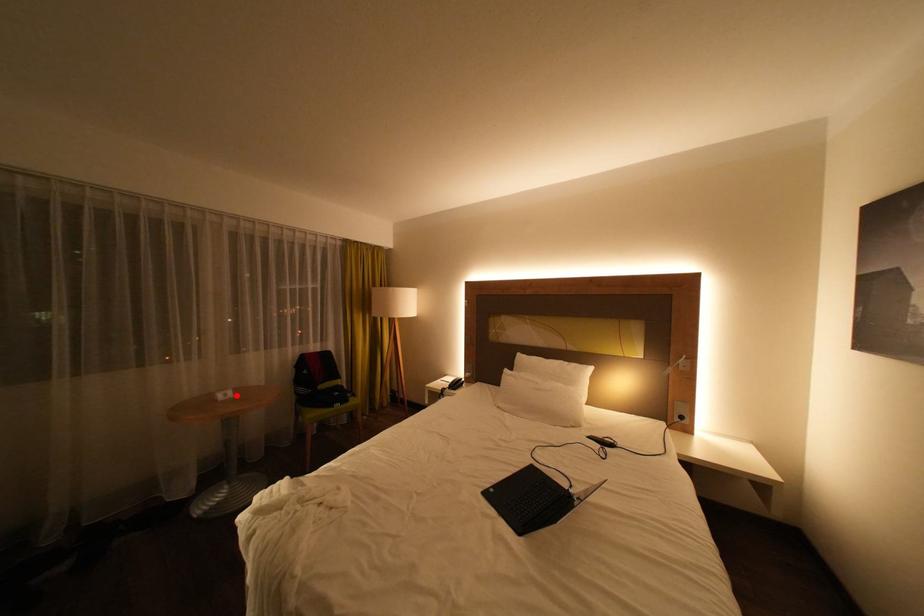
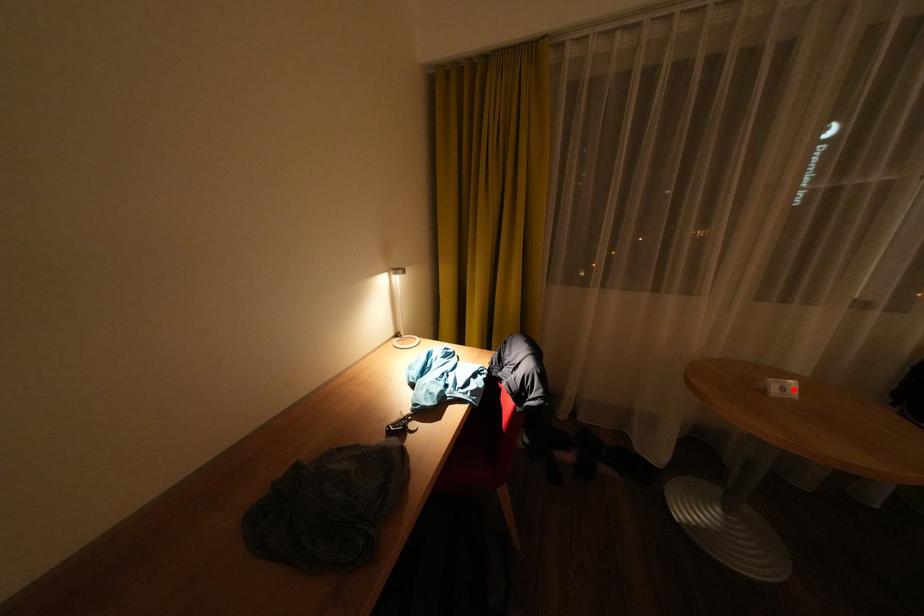
I am providing you with two images of the same scene from different viewpoints. A red point is marked on the first image and another point is marked on the second image. Does the point marked in image1 correspond to the same location as the one in image2?

Yes